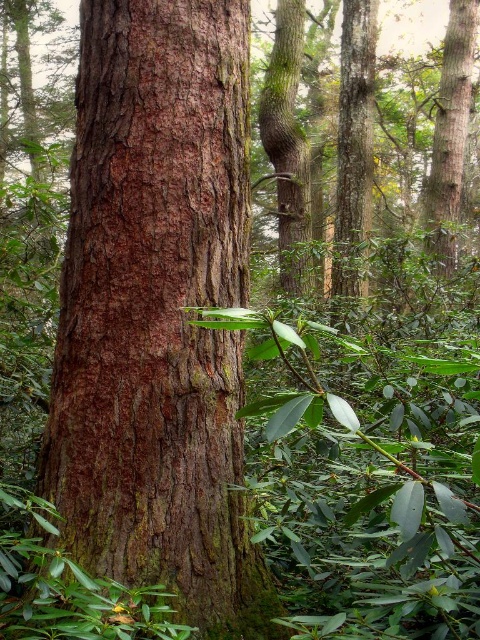
Consider the image. You are standing in the forest scene looking at the large tree trunk. There are two points marked in the image. The first point is at coordinate point (162, 4) and the second is at point (444, 148). Which of these two points is closer to you?

Point (162, 4) is closer to the viewer than point (444, 148).

You are a hiker who wants to identify the smaller tree trunk in this forest scene. Which one should you look for between the brown rough bark tree trunk at left and the smooth brown tree trunk at upper right?

The brown rough bark tree trunk at left is smaller in size compared to the smooth brown tree trunk at upper right, so you should look for the brown rough bark tree trunk at left.